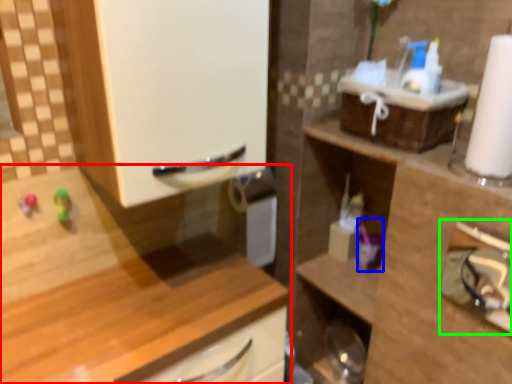
Question: Which is nearer to the cabinetry (highlighted by a red box)? toiletry (highlighted by a blue box) or shelf (highlighted by a green box).

Choices:
 (A) toiletry
 (B) shelf

Answer: (A)